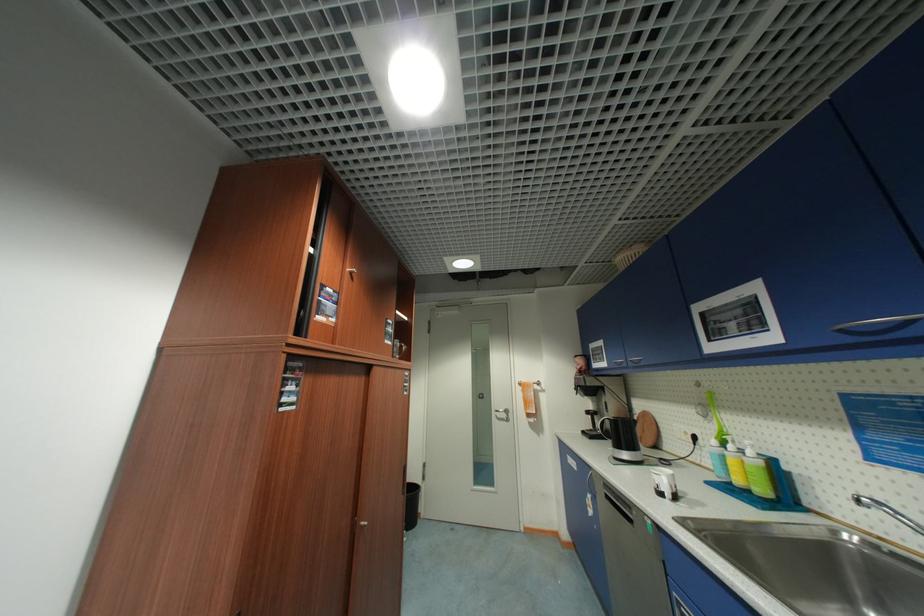
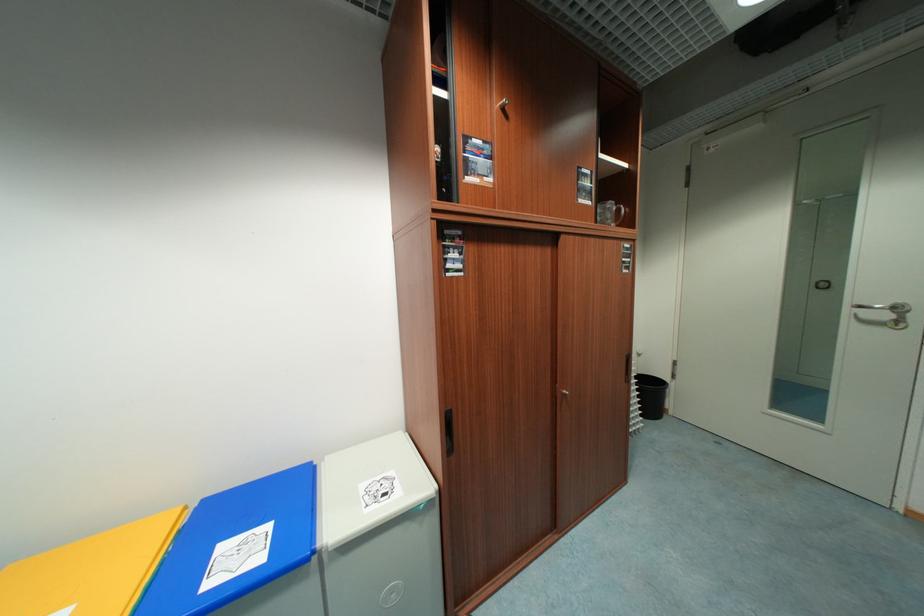
Where in the second image is the point corresponding to (x=424, y=482) from the first image?

(672, 379)